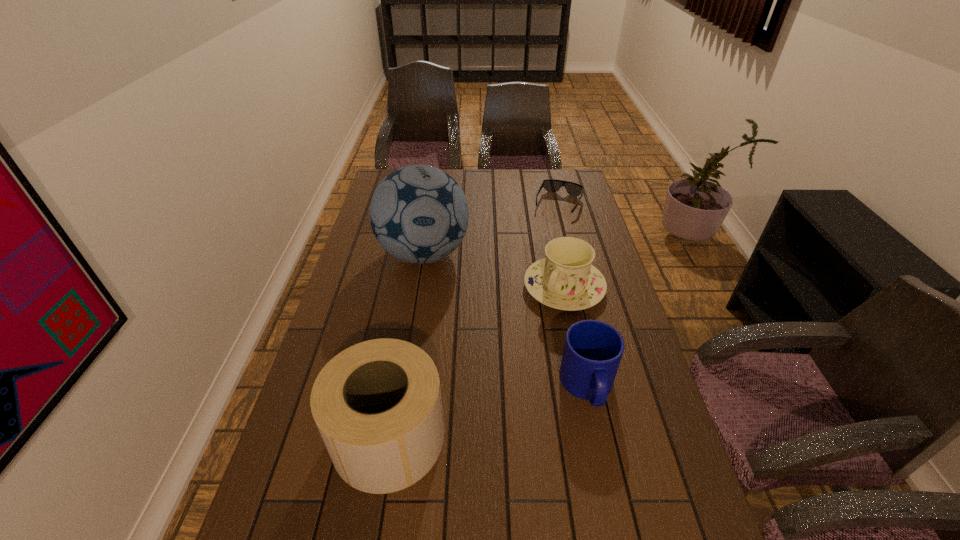
You are a GUI agent. You are given a task and a screenshot of the screen. Output one action in this format:
    pyautogui.click(x=<x>, y=<y>)
    Task: Click on the vacant space on the desktop that is between the toilet tissue and the mug and is positioned on the front-facing side of the farthest object
    The width and height of the screenshot is (960, 540).
    Given the screenshot: What is the action you would take?
    pyautogui.click(x=469, y=417)

This screenshot has width=960, height=540. Find the location of `vacant space on the desktop that is between the fourth shortest object and the mug and is positioned on the handle side of the chinaware`. vacant space on the desktop that is between the fourth shortest object and the mug and is positioned on the handle side of the chinaware is located at coordinates (466, 418).

Locate an element on the screen. This screenshot has width=960, height=540. vacant space on the desktop that is between the second tallest object and the mug and is positioned on the side with brand of the soccer ball is located at coordinates (518, 404).